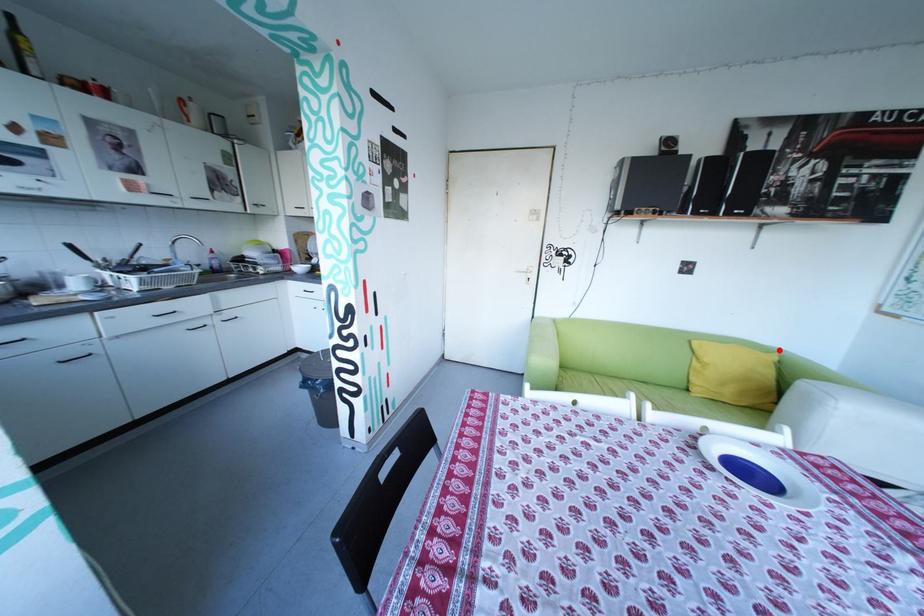
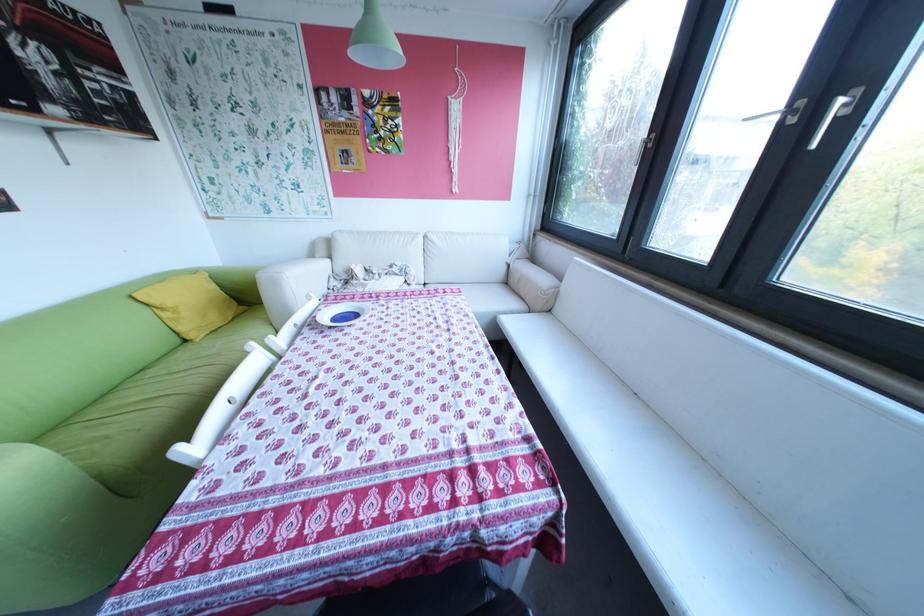
Question: I am providing you with two images of the same scene from different viewpoints. A red point is marked on the first image. At the location where the point appears in image 1, is it still visible in image 2?

Choices:
 (A) Yes
 (B) No

Answer: (A)